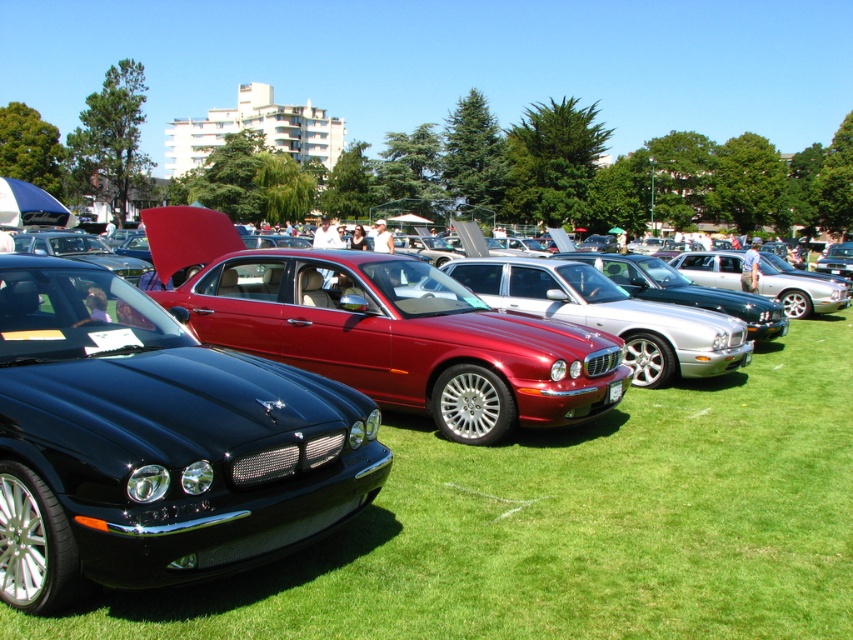
Is shiny black sedan at center wider than glossy metallic car at center?

Yes.

Who is more distant from viewer, (x=0, y=285) or (x=10, y=428)?

Positioned behind is point (x=0, y=285).

Identify the location of shiny black sedan at center. (155, 442).

You are a GUI agent. You are given a task and a screenshot of the screen. Output one action in this format:
    pyautogui.click(x=<x>, y=<y>)
    Task: Click on the shiny black sedan at center
    This screenshot has height=640, width=853.
    Given the screenshot: What is the action you would take?
    pyautogui.click(x=155, y=442)